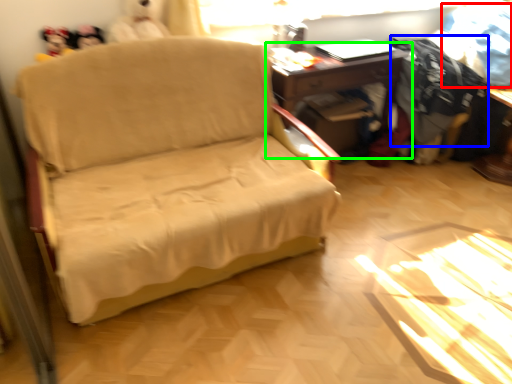
Question: Which object is the farthest from clothing (highlighted by a red box)? Choose among these: clothing (highlighted by a blue box) or table (highlighted by a green box).

Choices:
 (A) clothing
 (B) table

Answer: (B)